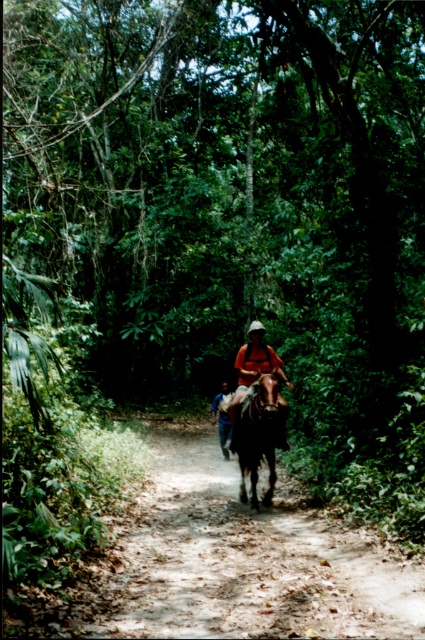
You are a hiker on the path and see two people wearing shirts in front of you. One is wearing an orange fabric shirt at center and the other a blue cotton shirt at center. Which shirt is positioned to the right of the other?

The orange fabric shirt at center is positioned to the right of the blue cotton shirt at center.

You are a hiker trying to follow the dirt path at center. If you are standing at the coordinates given in the description, which direction should you walk to stay on the path?

The dirt path at center is located at point (243,561). To stay on the path, you should walk towards that coordinate.

You are planning to walk along the dirt path at center while wearing an orange fabric shirt at center. Considering the width of the path, will your shirt be visible from both sides of the path?

The dirt path at center is wider than the orange fabric shirt at center, so yes, your shirt will be visible from both sides of the path.